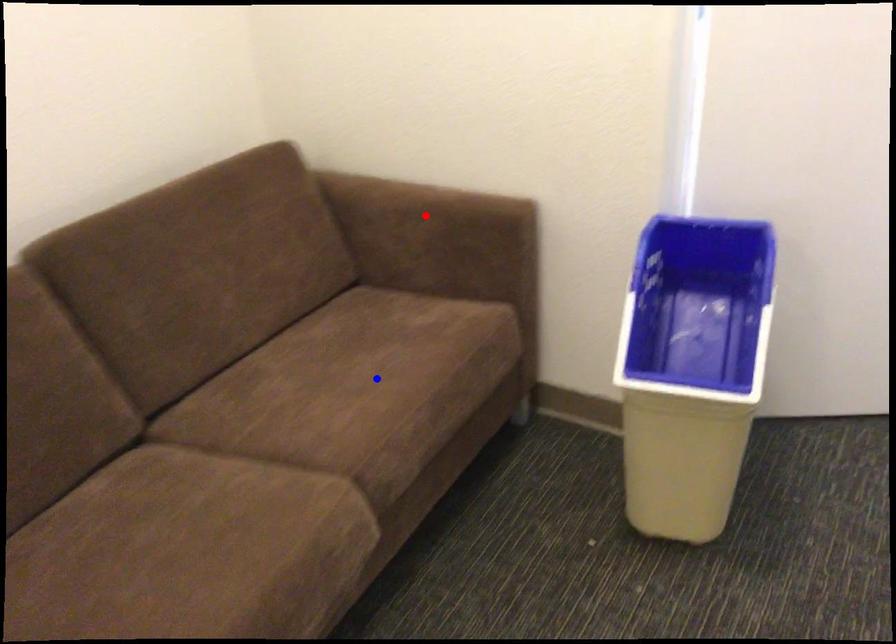
Question: Which of the two points in the image is closer to the camera?

Choices:
 (A) Blue point is closer.
 (B) Red point is closer.

Answer: (A)